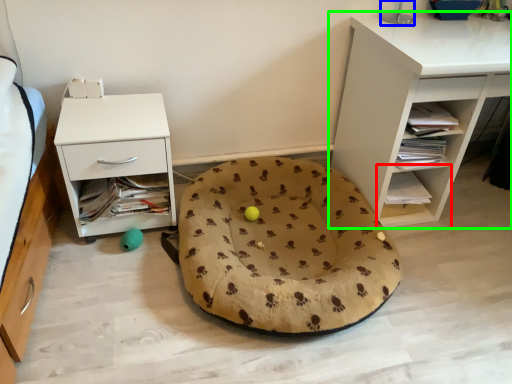
Question: Based on their relative distances, which object is farther from shelf (highlighted by a red box)? Choose from table lamp (highlighted by a blue box) and shelf (highlighted by a green box).

Choices:
 (A) table lamp
 (B) shelf

Answer: (A)